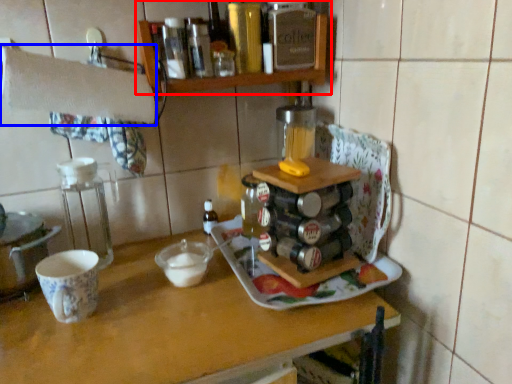
Question: Which object appears farthest to the camera in this image, shelf (highlighted by a red box) or towel bar (highlighted by a blue box)?

Choices:
 (A) shelf
 (B) towel bar

Answer: (A)